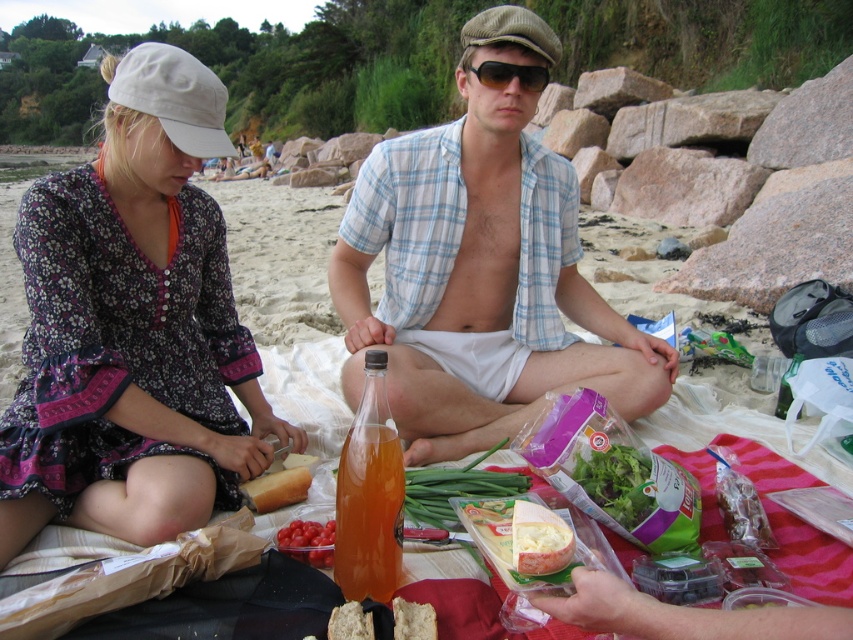
Which is in front, point (630, 522) or point (270, 496)?

Point (630, 522)

Does green leafy salad at center appear on the left side of white bread at center?

In fact, green leafy salad at center is to the right of white bread at center.

Is point (624, 502) closer to viewer compared to point (260, 508)?

Yes.

The image size is (853, 640). I want to click on green leafy salad at center, so click(618, 483).

Is green leafy salad at center taller than white crumbly bread at lower center?

Yes, green leafy salad at center is taller than white crumbly bread at lower center.

Does green leafy salad at center have a lesser height compared to white crumbly bread at lower center?

In fact, green leafy salad at center may be taller than white crumbly bread at lower center.

Does point (593, 467) come behind point (418, 605)?

Yes, it is behind point (418, 605).

In order to click on green leafy salad at center in this screenshot , I will do `click(618, 483)`.

Measure the distance between matte plaid shirt at center and white creamy cheese at center.

A distance of 30.01 inches exists between matte plaid shirt at center and white creamy cheese at center.

The width and height of the screenshot is (853, 640). What do you see at coordinates (480, 268) in the screenshot? I see `matte plaid shirt at center` at bounding box center [480, 268].

Between point (486, 289) and point (512, 522), which one is positioned behind?

The point (486, 289) is more distant.

At what (x,y) coordinates should I click in order to perform the action: click on matte plaid shirt at center. Please return your answer as a coordinate pair (x, y). This screenshot has height=640, width=853. Looking at the image, I should click on (480, 268).